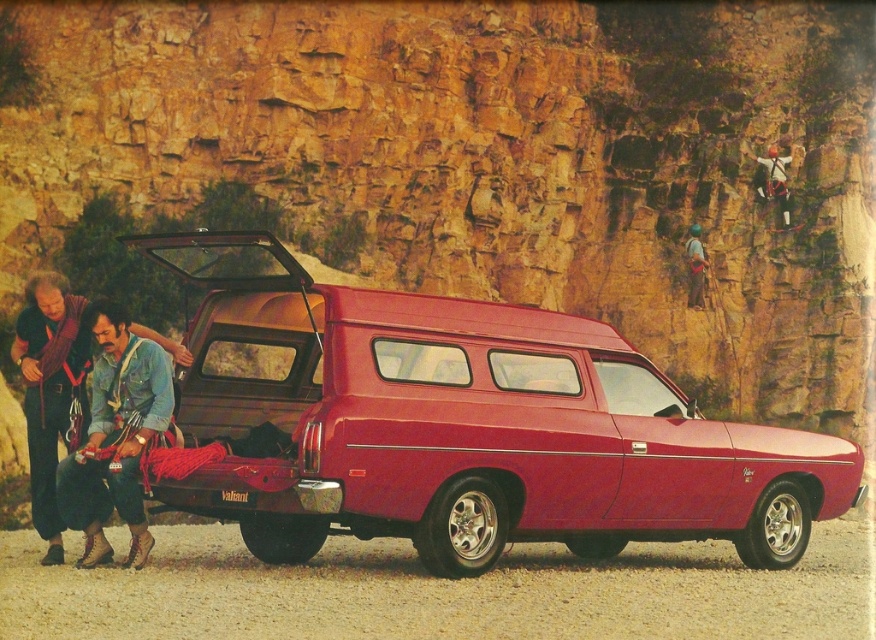
You are planning to load more climbing gear into the glossy red van at center. Considering the size of the rope climbing gear at upper right, will there be enough space in the van?

The glossy red van at center has a larger size compared to rope climbing gear at upper right, so there should be enough space to accommodate more climbing gear.

You are standing at the center of the image. Which direction should you move to reach the denim jacket at lower left?

Since the denim jacket at lower left is located at point (115, 435), you should move towards the lower left direction to reach it.